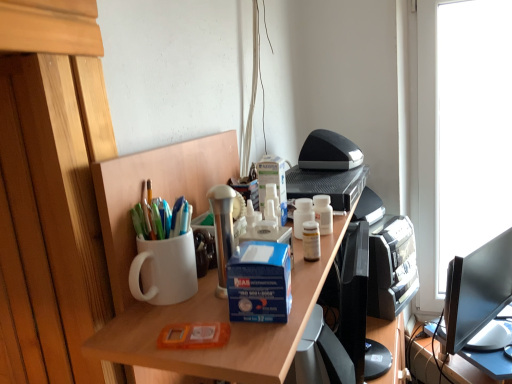
Where is `blank space to the left of blue cardboard box at center`? blank space to the left of blue cardboard box at center is located at coordinates (177, 319).